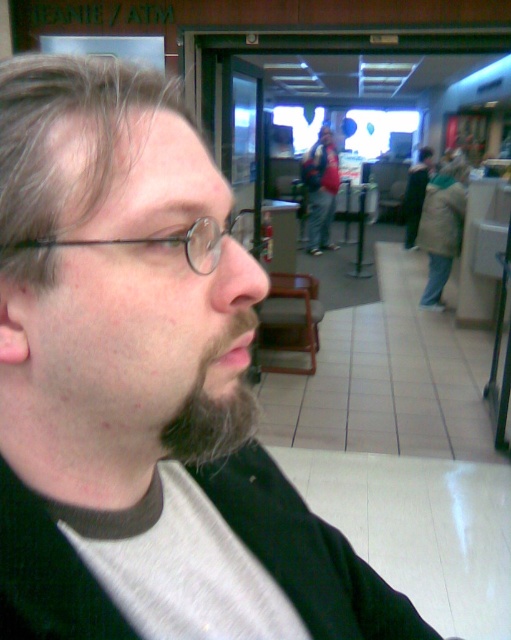
Is black metal glasses at left below matte black backpack at center?

Yes.

Where is `black metal glasses at left`? This screenshot has width=511, height=640. black metal glasses at left is located at coordinates pos(160,241).

Does dark brown fuzzy beard at lower left appear over black metal glasses at left?

Incorrect, dark brown fuzzy beard at lower left is not positioned above black metal glasses at left.

Between dark brown fuzzy beard at lower left and black metal glasses at left, which one is positioned higher?

black metal glasses at left is above.

Who is more distant from viewer, [217,381] or [234,225]?

Point [234,225]

Where is `dark brown fuzzy beard at lower left`? This screenshot has width=511, height=640. dark brown fuzzy beard at lower left is located at coordinates (217, 401).

Can you confirm if dark brown fuzzy beard at lower left is smaller than matte black backpack at center?

Correct, dark brown fuzzy beard at lower left occupies less space than matte black backpack at center.

Does dark brown fuzzy beard at lower left have a larger size compared to matte black backpack at center?

No.

Who is more distant from viewer, (166, 442) or (311, 205)?

The point (311, 205) is behind.

You are a GUI agent. You are given a task and a screenshot of the screen. Output one action in this format:
    pyautogui.click(x=<x>, y=<y>)
    Task: Click on the dark brown fuzzy beard at lower left
    The height and width of the screenshot is (640, 511).
    Given the screenshot: What is the action you would take?
    pyautogui.click(x=217, y=401)